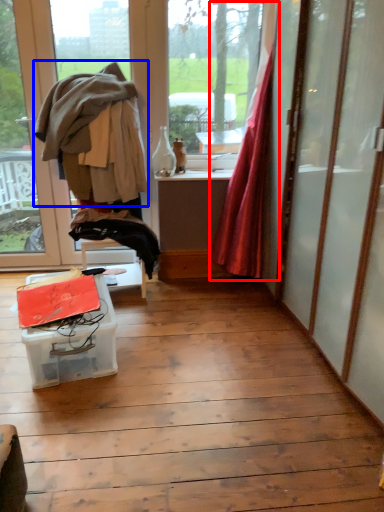
Question: Which object is further to the camera taking this photo, curtain (highlighted by a red box) or clothing (highlighted by a blue box)?

Choices:
 (A) curtain
 (B) clothing

Answer: (B)